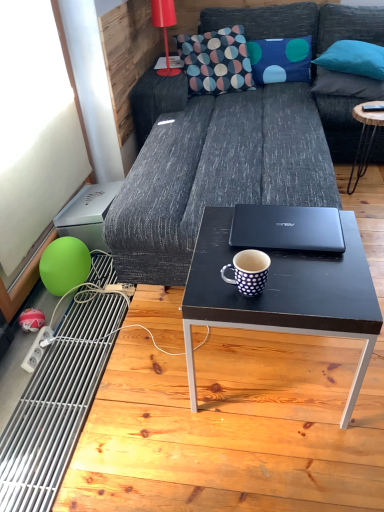
Question: In terms of width, does black wood coffee table at right, which appears as the first coffee table when viewed from the right, look wider or thinner when compared to black matte coffee table at center, which appears as the 1th coffee table when viewed from the front?

Choices:
 (A) wide
 (B) thin

Answer: (B)

Question: Considering the positions of black wood coffee table at right, positioned as the 2th coffee table in left-to-right order, and black matte coffee table at center, which is counted as the 1th coffee table, starting from the left, in the image, is black wood coffee table at right, positioned as the 2th coffee table in left-to-right order, bigger or smaller than black matte coffee table at center, which is counted as the 1th coffee table, starting from the left,?

Choices:
 (A) big
 (B) small

Answer: (B)

Question: Considering the real-world distances, which object is closest to the black matte laptop at center?

Choices:
 (A) patterned fabric pillow at upper center
 (B) blue dotted fabric pillow at upper center, the first pillow when ordered from left to right
 (C) black wood coffee table at right, which appears as the first coffee table when viewed from the right
 (D) black matte coffee table at center, which appears as the 1th coffee table when viewed from the front
 (E) matte red lamp at upper left

Answer: (D)

Question: Which object is positioned farthest from the patterned fabric pillow at upper center?

Choices:
 (A) black matte laptop at center
 (B) black wood coffee table at right, which is the 1th coffee table in top-to-bottom order
 (C) black matte coffee table at center, which appears as the 1th coffee table when viewed from the front
 (D) white dotted ceramic mug at center
 (E) dark gray fabric couch at center

Answer: (D)